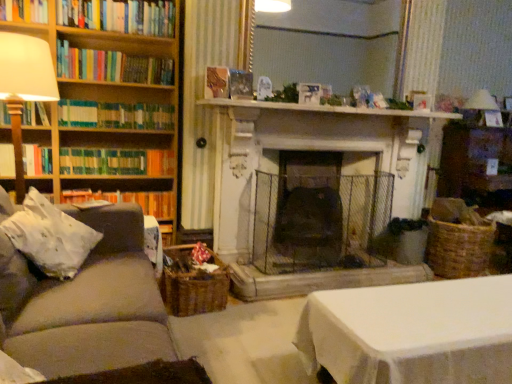
Question: Is wooden bookshelf at left next to woven brown basket at lower center?

Choices:
 (A) yes
 (B) no

Answer: (B)

Question: Does wooden bookshelf at left turn towards woven brown basket at lower center?

Choices:
 (A) no
 (B) yes

Answer: (B)

Question: Is wooden bookshelf at left smaller than woven brown basket at lower center?

Choices:
 (A) yes
 (B) no

Answer: (B)

Question: From a real-world perspective, is wooden bookshelf at left located higher than woven brown basket at lower center?

Choices:
 (A) no
 (B) yes

Answer: (B)

Question: Is wooden bookshelf at left further to camera compared to woven brown basket at lower center?

Choices:
 (A) yes
 (B) no

Answer: (A)

Question: Which is correct: wooden bookshelf at left is inside matte white table lamp at upper right, which appears as the second table lamp when viewed from the left, or outside of it?

Choices:
 (A) outside
 (B) inside

Answer: (A)

Question: Considering the positions of wooden bookshelf at left and matte white table lamp at upper right, marked as the first table lamp in a back-to-front arrangement, in the image, is wooden bookshelf at left bigger or smaller than matte white table lamp at upper right, marked as the first table lamp in a back-to-front arrangement,?

Choices:
 (A) big
 (B) small

Answer: (A)

Question: From the image's perspective, is wooden bookshelf at left above or below matte white table lamp at upper right, marked as the first table lamp in a back-to-front arrangement?

Choices:
 (A) below
 (B) above

Answer: (A)

Question: Is point click(110, 175) positioned closer to the camera than point click(482, 99)?

Choices:
 (A) closer
 (B) farther

Answer: (A)

Question: Considering the relative positions of gray fabric couch at left and hardcover books at left, which is the third book from top to bottom, in the image provided, is gray fabric couch at left to the left or to the right of hardcover books at left, which is the third book from top to bottom,?

Choices:
 (A) right
 (B) left

Answer: (A)

Question: Do you think gray fabric couch at left is within hardcover books at left, which is counted as the 6th book, starting from the bottom, or outside of it?

Choices:
 (A) outside
 (B) inside

Answer: (A)

Question: Considering the positions of gray fabric couch at left and hardcover books at left, which is counted as the 6th book, starting from the bottom, in the image, is gray fabric couch at left wider or thinner than hardcover books at left, which is counted as the 6th book, starting from the bottom,?

Choices:
 (A) wide
 (B) thin

Answer: (A)

Question: Looking at the image, does gray fabric couch at left seem bigger or smaller compared to hardcover books at left, which is counted as the 6th book, starting from the bottom?

Choices:
 (A) small
 (B) big

Answer: (B)

Question: Choose the correct answer: Is white fabric pillow at left inside green matte bookshelf at left, arranged as the 3th book when ordered from the bottom, or outside it?

Choices:
 (A) outside
 (B) inside

Answer: (A)

Question: In the image, is white fabric pillow at left positioned in front of or behind green matte bookshelf at left, which is counted as the sixth book, starting from the top?

Choices:
 (A) front
 (B) behind

Answer: (A)